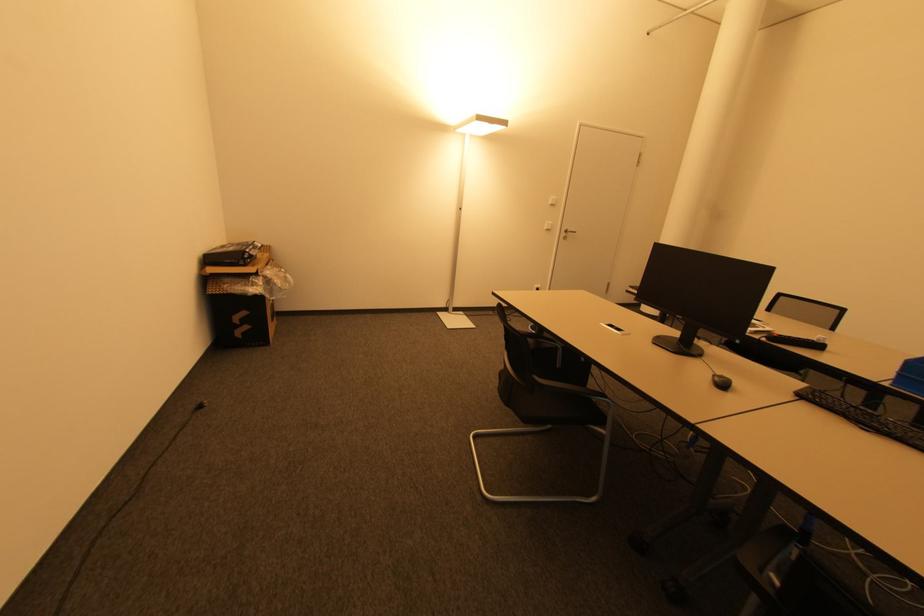
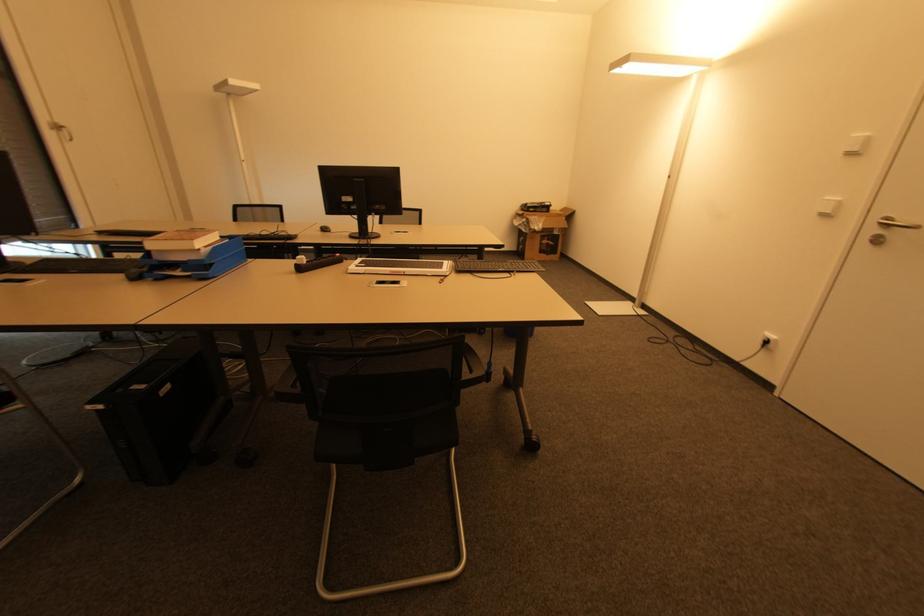
In the second image, find the point that corresponds to [725,386] in the first image.

(325, 230)